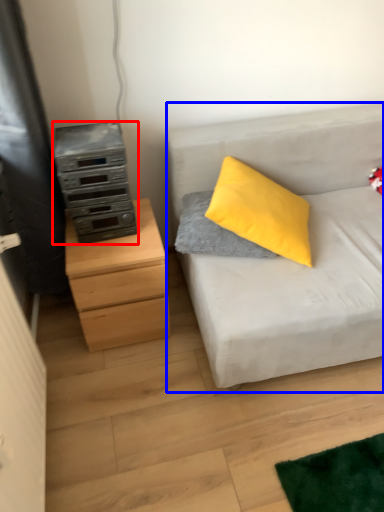
Question: Which object appears farthest to the camera in this image, appliance (highlighted by a red box) or studio couch (highlighted by a blue box)?

Choices:
 (A) appliance
 (B) studio couch

Answer: (A)